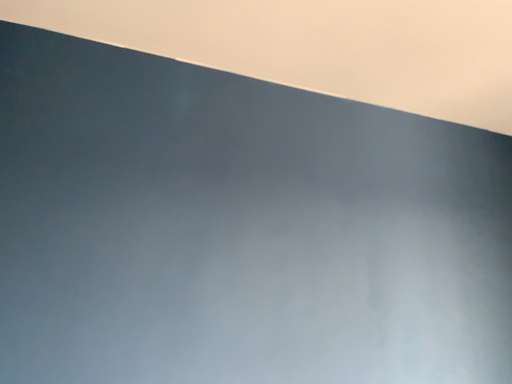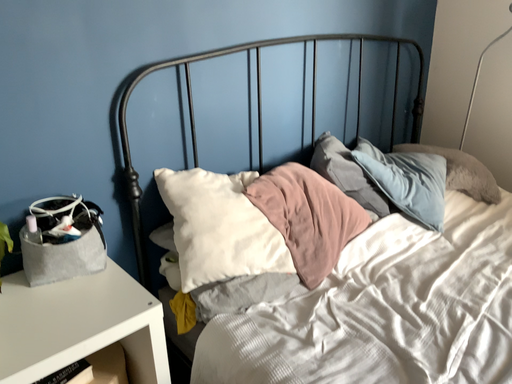
Question: Which way did the camera rotate in the video?

Choices:
 (A) rotated right
 (B) rotated left

Answer: (A)